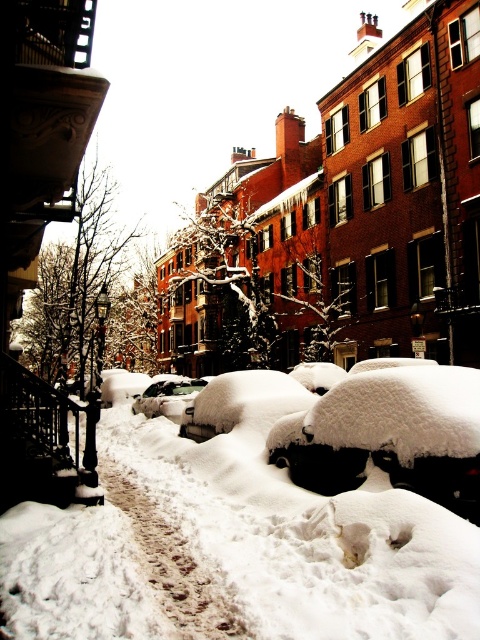
Is white fluffy snow at center to the left of shiny silver car at center from the viewer's perspective?

Incorrect, white fluffy snow at center is not on the left side of shiny silver car at center.

Is point (298, 442) in front of point (186, 403)?

Yes, point (298, 442) is closer to viewer.

Find the location of a particular element. white fluffy snow at center is located at coordinates [x=322, y=500].